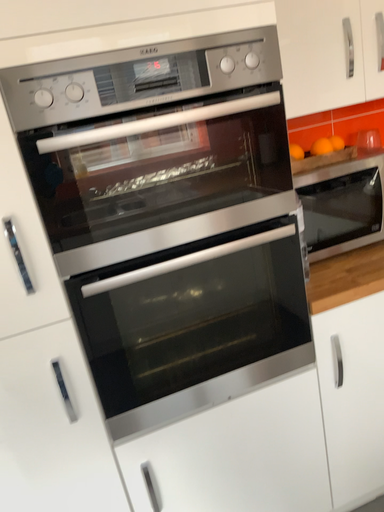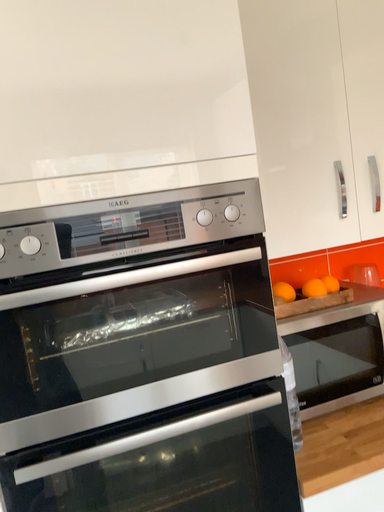
Question: Which way did the camera rotate in the video?

Choices:
 (A) rotated upward
 (B) rotated downward

Answer: (A)